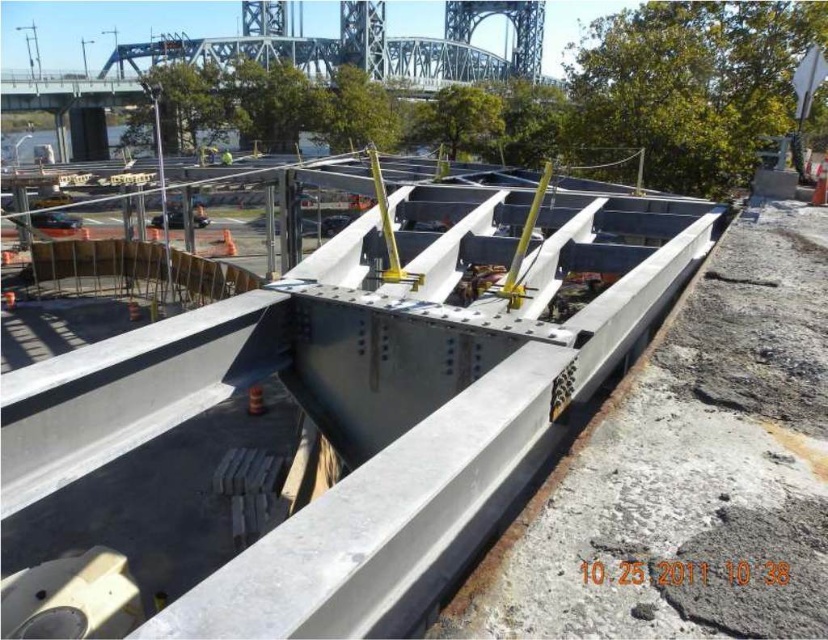
Question: Among these points, which one is nearest to the camera?

Choices:
 (A) (675, 365)
 (B) (224, 154)

Answer: (A)

Question: Is gray metallic beam at center to the left of yellow fabric construction worker at center from the viewer's perspective?

Choices:
 (A) no
 (B) yes

Answer: (A)

Question: Which point is closer to the camera taking this photo?

Choices:
 (A) (x=224, y=152)
 (B) (x=600, y=420)

Answer: (B)

Question: Is gray metallic beam at center positioned in front of yellow fabric construction worker at center?

Choices:
 (A) no
 (B) yes

Answer: (B)

Question: Is gray metallic beam at center further to the viewer compared to yellow fabric construction worker at center?

Choices:
 (A) yes
 (B) no

Answer: (B)